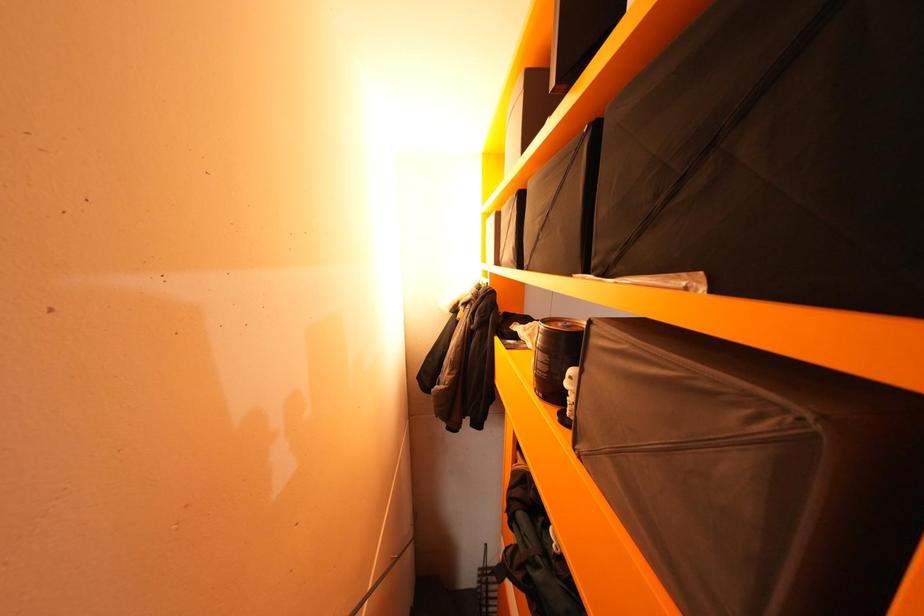
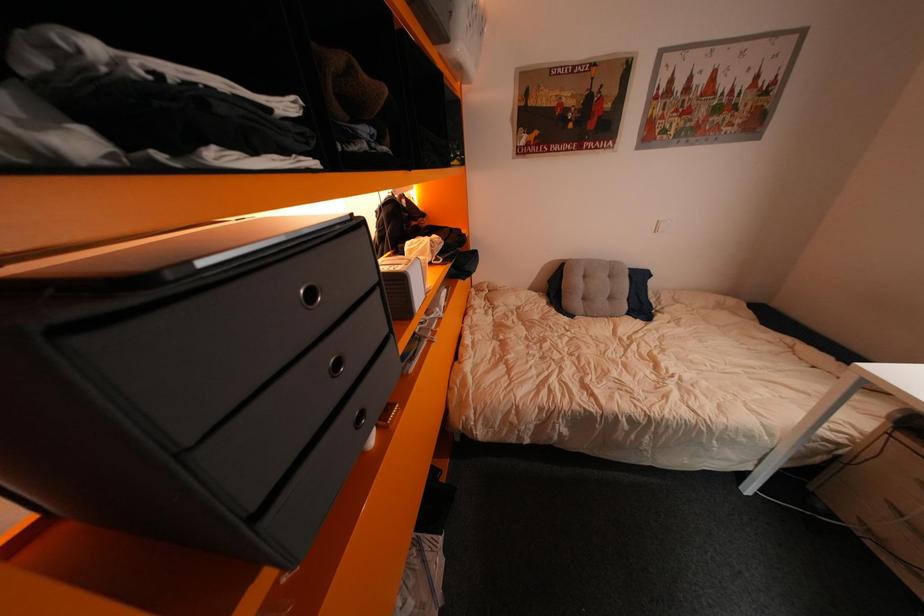
Question: How did the camera likely rotate?

Choices:
 (A) Left
 (B) Right
 (C) Up
 (D) Down

Answer: (D)